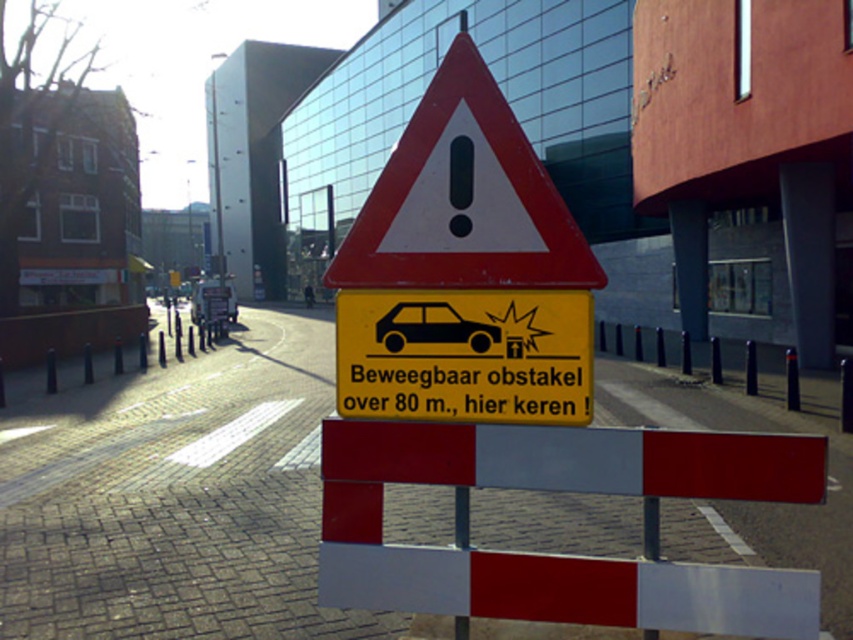
You are a driver approaching the yellow paper sign at center and the red plastic barrier at center. According to the scene description, which object is closer to you?

The yellow paper sign at center is closer because it is in front of the red plastic barrier at center.

From the picture: You are a delivery driver approaching the yellow paper sign at center and red plastic barrier at center on a road with a 15 meter width. Can your truck, which is 12 meters long, safely navigate between them without crossing the center line?

The yellow paper sign at center and red plastic barrier at center are 13.19 meters apart. Since the truck is 12 meters long, it can safely navigate between them without crossing the center line as there is enough space.

You are a delivery driver approaching the reflective plastic barrier at center and the yellow paper sign at center. Your truck is 2.5 meters wide. Can you pass through the space between them without touching either?

The reflective plastic barrier at center is bigger than the yellow paper sign at center, but the exact distance between them isn